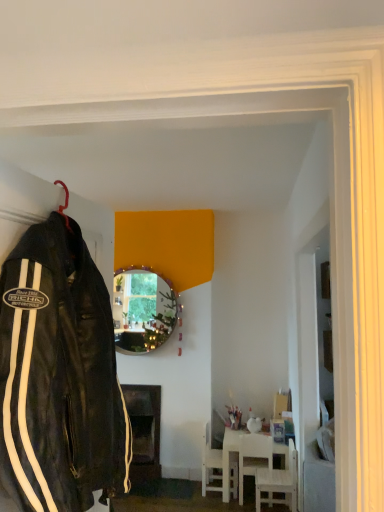
Question: Is white wood chair at lower center, placed as the 2th chair when sorted from right to left, positioned behind black leather jacket at left?

Choices:
 (A) yes
 (B) no

Answer: (A)

Question: Is white wood chair at lower center, acting as the second chair starting from the left, positioned with its back to black leather jacket at left?

Choices:
 (A) yes
 (B) no

Answer: (A)

Question: Can you confirm if white wood chair at lower center, acting as the second chair starting from the left, is positioned to the left of black leather jacket at left?

Choices:
 (A) yes
 (B) no

Answer: (B)

Question: Is white wood chair at lower center, acting as the second chair starting from the left, closer to camera compared to black leather jacket at left?

Choices:
 (A) no
 (B) yes

Answer: (A)

Question: From the image's perspective, is white wood chair at lower center, placed as the 2th chair when sorted from right to left, above black leather jacket at left?

Choices:
 (A) yes
 (B) no

Answer: (B)

Question: From the image's perspective, is white plastic chair at lower center, which is the first chair from left to right, positioned above or below shiny gold mirror at center?

Choices:
 (A) below
 (B) above

Answer: (A)

Question: Do you think white plastic chair at lower center, which is the first chair from left to right, is within shiny gold mirror at center, or outside of it?

Choices:
 (A) inside
 (B) outside

Answer: (B)

Question: Does point (216, 477) appear closer or farther from the camera than point (142, 294)?

Choices:
 (A) farther
 (B) closer

Answer: (B)

Question: In the image, is white plastic chair at lower center, which is the first chair from left to right, on the left side or the right side of shiny gold mirror at center?

Choices:
 (A) left
 (B) right

Answer: (B)

Question: Is white plastic chair at lower center, positioned as the 3th chair in right-to-left order, inside or outside of white wooden chair at lower right, the first chair from the right?

Choices:
 (A) inside
 (B) outside

Answer: (B)

Question: In terms of height, does white plastic chair at lower center, which is the first chair from left to right, look taller or shorter compared to white wooden chair at lower right, the first chair from the right?

Choices:
 (A) tall
 (B) short

Answer: (A)

Question: Considering the positions of white plastic chair at lower center, which is the first chair from left to right, and white wooden chair at lower right, the first chair from the right, in the image, is white plastic chair at lower center, which is the first chair from left to right, wider or thinner than white wooden chair at lower right, the first chair from the right,?

Choices:
 (A) wide
 (B) thin

Answer: (B)

Question: Considering the positions of white plastic chair at lower center, positioned as the 3th chair in right-to-left order, and white wooden chair at lower right, arranged as the 3th chair when viewed from the left, in the image, is white plastic chair at lower center, positioned as the 3th chair in right-to-left order, bigger or smaller than white wooden chair at lower right, arranged as the 3th chair when viewed from the left,?

Choices:
 (A) big
 (B) small

Answer: (B)

Question: Does point (125, 284) appear closer or farther from the camera than point (107, 384)?

Choices:
 (A) farther
 (B) closer

Answer: (A)

Question: Considering the positions of shiny gold mirror at center and black leather jacket at left in the image, is shiny gold mirror at center wider or thinner than black leather jacket at left?

Choices:
 (A) thin
 (B) wide

Answer: (A)